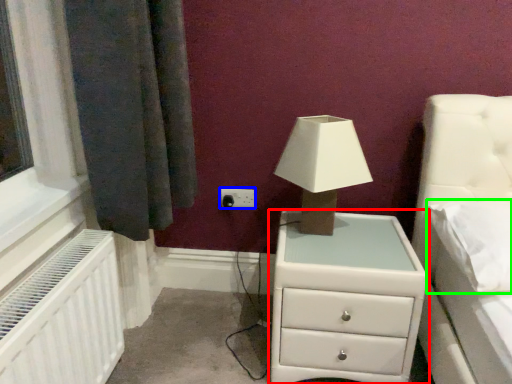
Question: Which object is positioned farthest from chest of drawers (highlighted by a red box)? Select from electric outlet (highlighted by a blue box) and pillow (highlighted by a green box).

Choices:
 (A) electric outlet
 (B) pillow

Answer: (A)